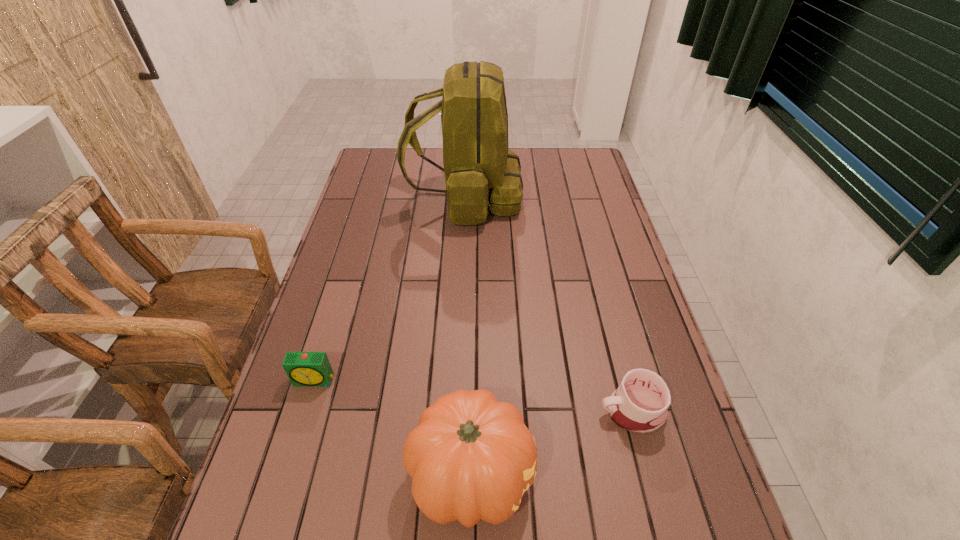
Locate an element on the screen. This screenshot has height=540, width=960. the closest object to the pumpkin is located at coordinates (639, 405).

Identify the location of object that can be found as the second closest to the third nearest object. (480, 171).

Where is `vacant point that satisfies the following two spatial constraints: 1. on the front-facing side of the backpack; 2. on the front-facing side of the third nearest object`? This screenshot has height=540, width=960. vacant point that satisfies the following two spatial constraints: 1. on the front-facing side of the backpack; 2. on the front-facing side of the third nearest object is located at coordinates (457, 380).